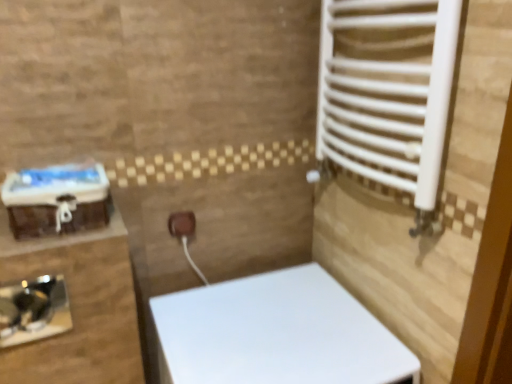
What do you see at coordinates (33, 310) in the screenshot? The image size is (512, 384). I see `black glossy sink at lower left` at bounding box center [33, 310].

What do you see at coordinates (182, 224) in the screenshot? The height and width of the screenshot is (384, 512). I see `brown matte electric outlet at center` at bounding box center [182, 224].

The width and height of the screenshot is (512, 384). What do you see at coordinates (276, 333) in the screenshot?
I see `white glossy toilet at center` at bounding box center [276, 333].

I want to click on black glossy sink at lower left, so [x=33, y=310].

Does white glossy toilet at center have a larger size compared to brown matte electric outlet at center?

Yes, white glossy toilet at center is bigger than brown matte electric outlet at center.

How different are the orientations of white glossy toilet at center and brown matte electric outlet at center in degrees?

The angular difference between white glossy toilet at center and brown matte electric outlet at center is 0.672 degrees.

Considering the sizes of objects white glossy toilet at center and brown matte electric outlet at center in the image provided, who is shorter, white glossy toilet at center or brown matte electric outlet at center?

Standing shorter between the two is brown matte electric outlet at center.

Locate an element on the screen. toilet below the brown matte electric outlet at center (from a real-world perspective) is located at coordinates (276, 333).

Is brown matte electric outlet at center in front of or behind white glossy toilet at center in the image?

brown matte electric outlet at center is positioned farther from the viewer than white glossy toilet at center.

Which is further, (187, 224) or (210, 296)?

Positioned behind is point (210, 296).

From a real-world perspective, is brown matte electric outlet at center located beneath white glossy toilet at center?

No.

Where is `sink behind the white glossy toilet at center`? The width and height of the screenshot is (512, 384). sink behind the white glossy toilet at center is located at coordinates (33, 310).

Between white glossy toilet at center and black glossy sink at lower left, which one appears on the right side from the viewer's perspective?

From the viewer's perspective, white glossy toilet at center appears more on the right side.

Choose the correct answer: Is white glossy toilet at center inside black glossy sink at lower left or outside it?

white glossy toilet at center is located beyond the bounds of black glossy sink at lower left.

Considering the points (190, 337) and (11, 285), which point is in front, point (190, 337) or point (11, 285)?

Point (11, 285)

Based on their sizes in the image, would you say brown matte electric outlet at center is bigger or smaller than black glossy sink at lower left?

In the image, brown matte electric outlet at center appears to be smaller than black glossy sink at lower left.

Considering the relative positions of brown matte electric outlet at center and black glossy sink at lower left in the image provided, is brown matte electric outlet at center in front of black glossy sink at lower left?

No, brown matte electric outlet at center is behind black glossy sink at lower left.

Between brown matte electric outlet at center and black glossy sink at lower left, which one has smaller width?

black glossy sink at lower left.

From a real-world perspective, which object rests below the other?

From a 3D spatial view, black glossy sink at lower left is below.

Who is taller, black glossy sink at lower left or white glossy toilet at center?

white glossy toilet at center.

Between point (45, 295) and point (173, 380), which one is positioned in front?

The point (45, 295) is in front.

Which is more to the right, black glossy sink at lower left or white glossy toilet at center?

white glossy toilet at center.

Relative to brown matte electric outlet at center, is black glossy sink at lower left in front or behind?

In the image, black glossy sink at lower left appears in front of brown matte electric outlet at center.

From a real-world perspective, which object stands above the other?

brown matte electric outlet at center, from a real-world perspective.

In terms of height, does black glossy sink at lower left look taller or shorter compared to brown matte electric outlet at center?

Considering their sizes, black glossy sink at lower left has more height than brown matte electric outlet at center.

This screenshot has width=512, height=384. In order to click on toilet beneath the brown matte electric outlet at center (from a real-world perspective) in this screenshot , I will do 276,333.

This screenshot has height=384, width=512. I want to click on electric outlet above the white glossy toilet at center (from the image's perspective), so click(x=182, y=224).

Estimate the real-world distances between objects in this image. Which object is further from white glossy toilet at center, black glossy sink at lower left or brown matte electric outlet at center?

black glossy sink at lower left lies further to white glossy toilet at center than the other object.

Which object lies nearer to the anchor point black glossy sink at lower left, brown matte electric outlet at center or white glossy toilet at center?

Based on the image, brown matte electric outlet at center appears to be nearer to black glossy sink at lower left.

Considering their positions, is brown matte electric outlet at center positioned further to white glossy toilet at center than black glossy sink at lower left?

black glossy sink at lower left is positioned further to the anchor white glossy toilet at center.

Which object lies nearer to the anchor point black glossy sink at lower left, white glossy toilet at center or brown matte electric outlet at center?

brown matte electric outlet at center is positioned closer to the anchor black glossy sink at lower left.

From the image, which object appears to be farther from brown matte electric outlet at center, white glossy toilet at center or black glossy sink at lower left?

Among the two, black glossy sink at lower left is located further to brown matte electric outlet at center.

Considering their positions, is black glossy sink at lower left positioned closer to brown matte electric outlet at center than white glossy toilet at center?

The object closer to brown matte electric outlet at center is white glossy toilet at center.

What are the coordinates of `electric outlet located between black glossy sink at lower left and white glossy toilet at center in the left-right direction` in the screenshot? It's located at (182, 224).